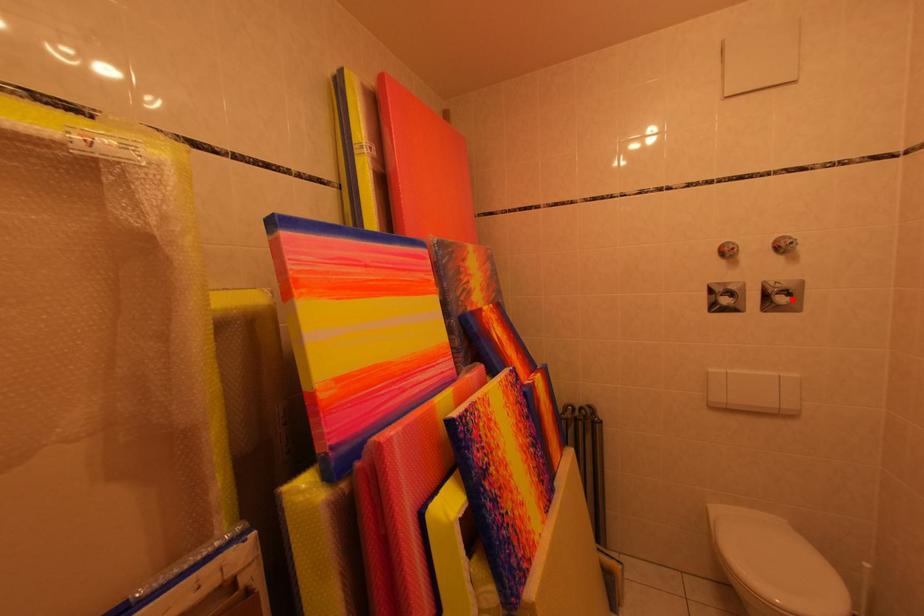
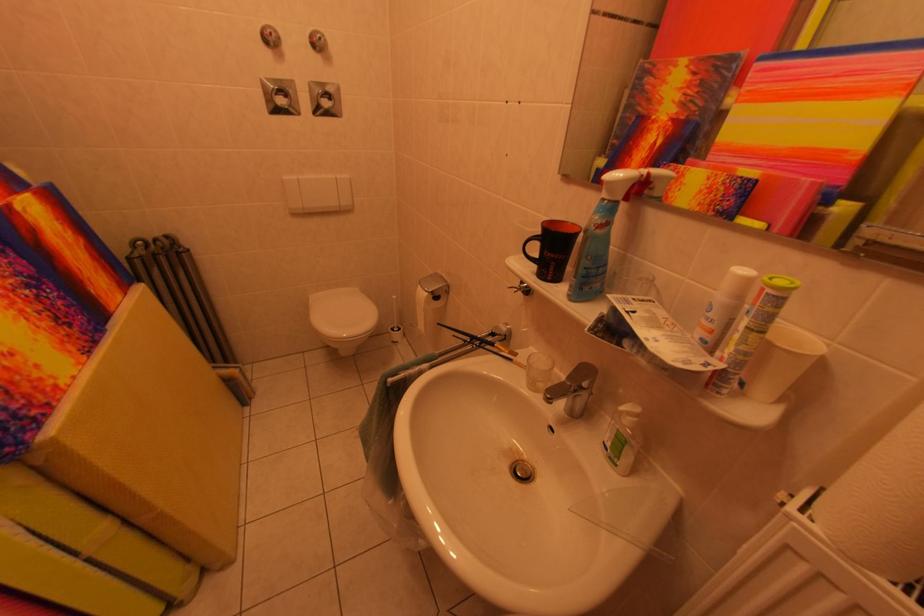
In the second image, find the point that corresponds to the highlighted location in the first image.

(334, 103)